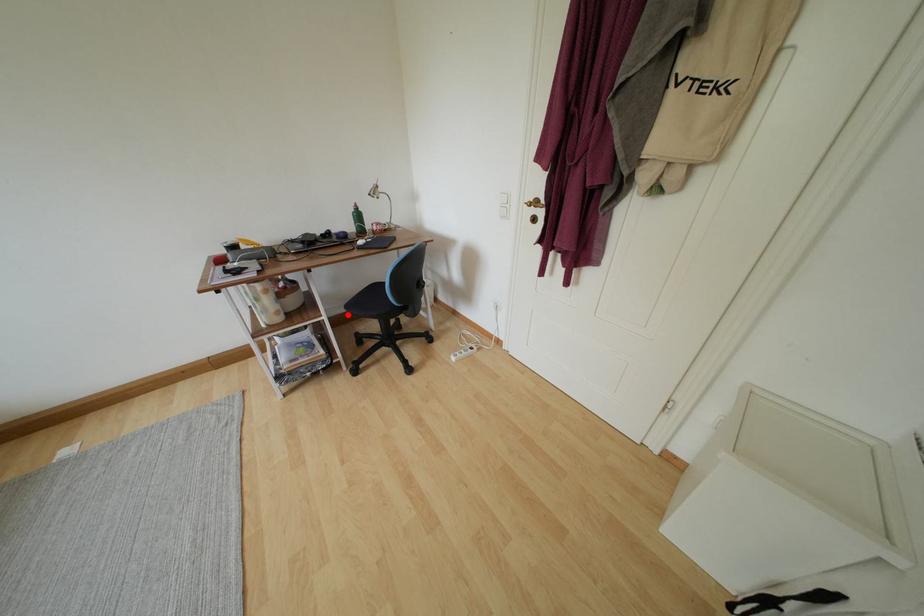
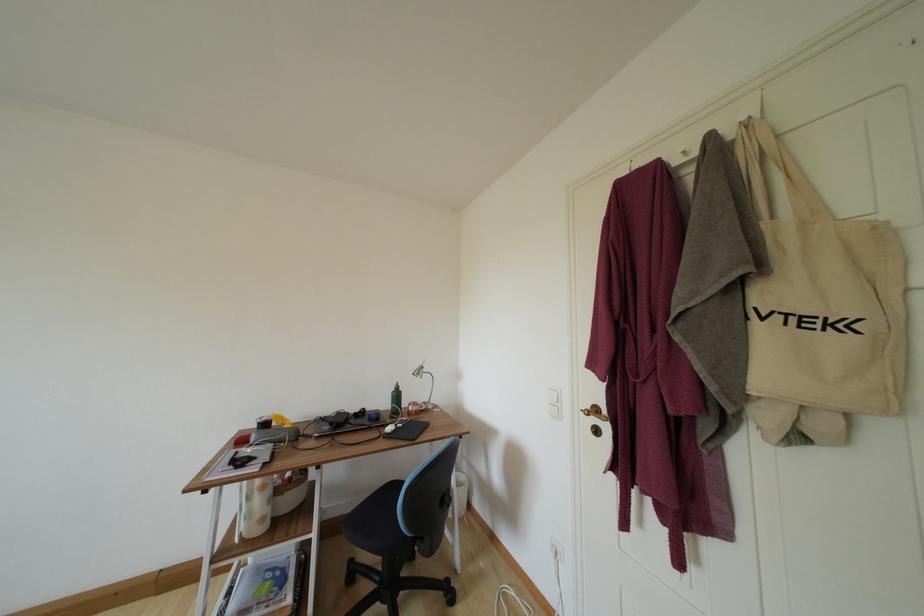
Question: A red point is marked in image1. In image2, is the corresponding 3D point closer to the camera or farther? Reply with the corresponding letter.

Choices:
 (A) The corresponding 3D point is closer.
 (B) The corresponding 3D point is farther.

Answer: (A)